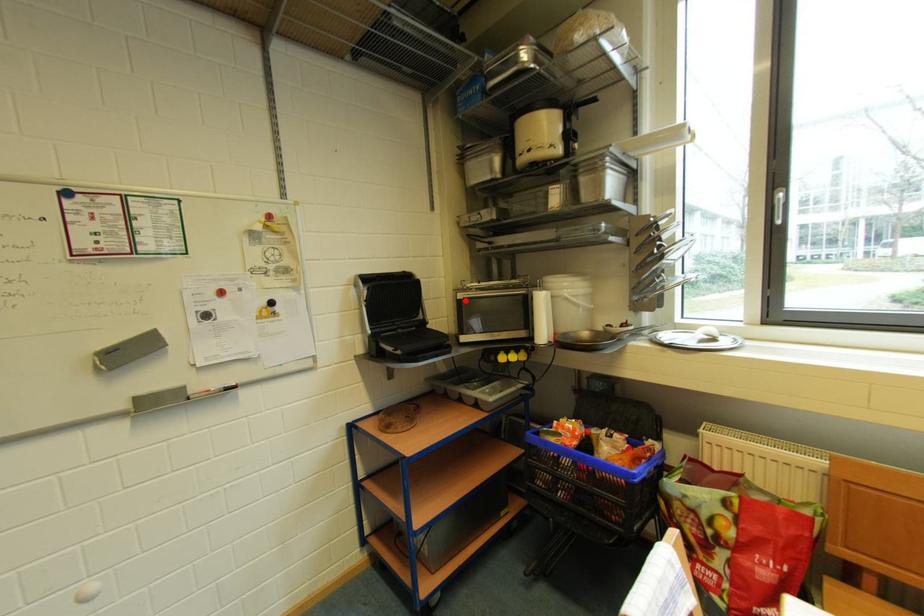
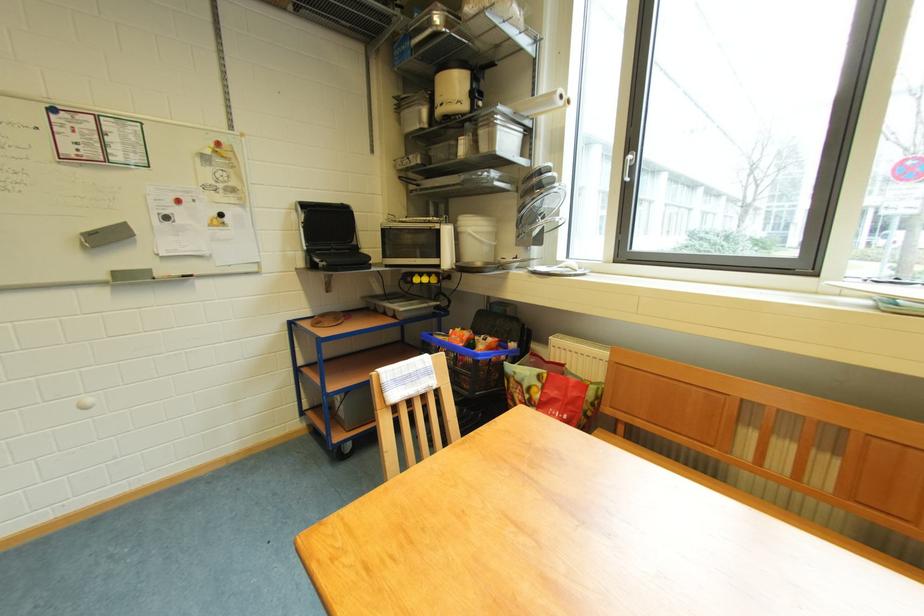
In the second image, find the point that corresponds to the highlighted location in the first image.

(390, 230)